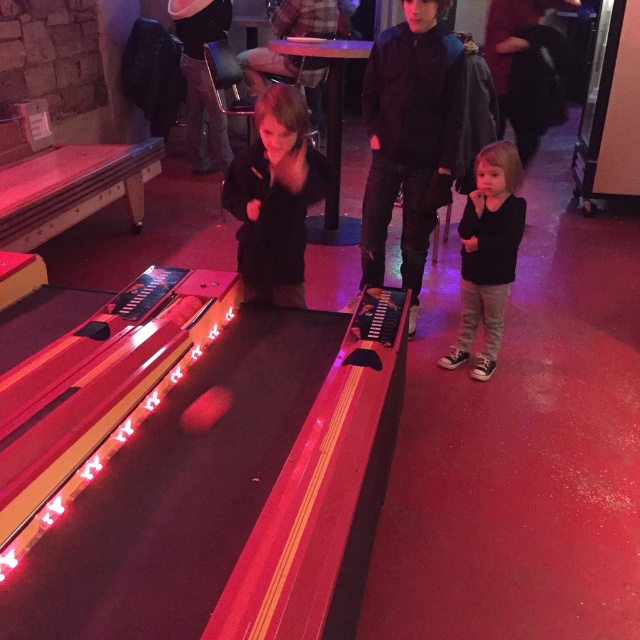
Question: Can you confirm if dark blue jacket at center is bigger than black matte jacket at center?

Choices:
 (A) no
 (B) yes

Answer: (B)

Question: Is dark blue jacket at center below black matte jacket at center?

Choices:
 (A) yes
 (B) no

Answer: (B)

Question: Which object is positioned farthest from the dark blue jacket at center?

Choices:
 (A) black matte shirt at right
 (B) black matte jacket at center

Answer: (B)

Question: Which of these objects is positioned farthest from the black matte jacket at center?

Choices:
 (A) black matte shirt at right
 (B) dark blue jacket at center

Answer: (A)

Question: Is dark blue jacket at center behind black matte shirt at right?

Choices:
 (A) yes
 (B) no

Answer: (B)

Question: Considering the real-world distances, which object is closest to the dark blue jacket at center?

Choices:
 (A) black matte jacket at center
 (B) black matte shirt at right

Answer: (B)